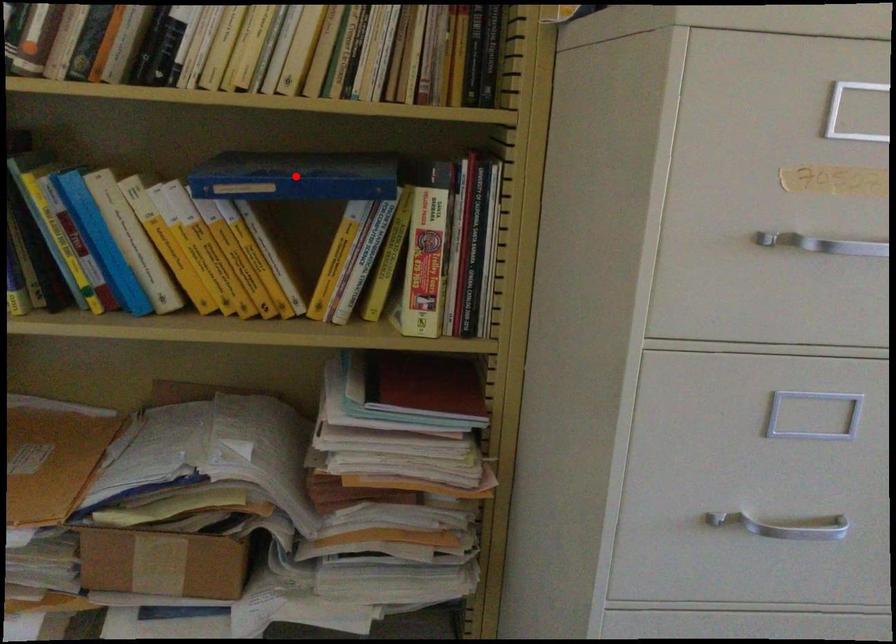
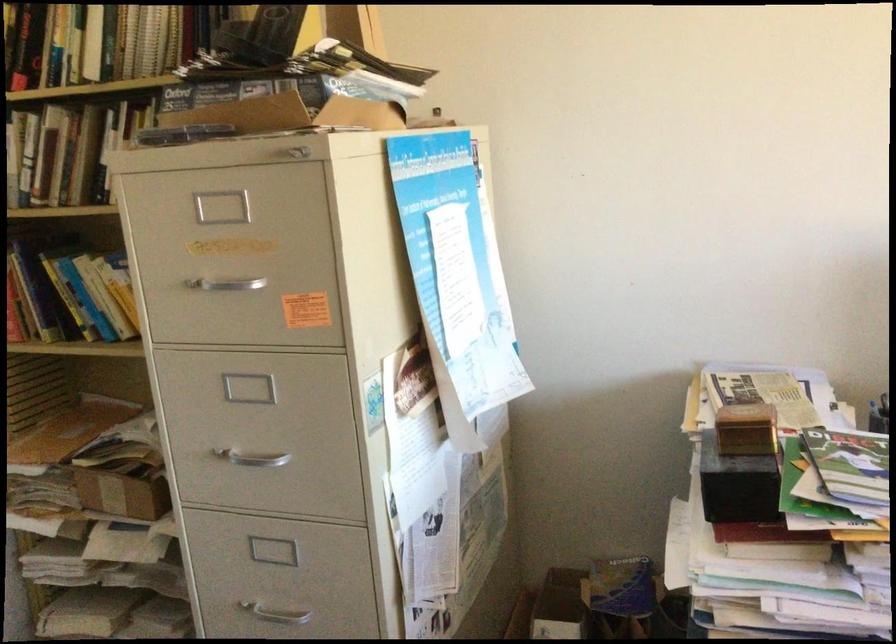
Question: I am providing you with two images of the same scene from different viewpoints. A red point is marked on the first image. Is the red point's position out of view in image 2?

Choices:
 (A) Yes
 (B) No

Answer: (A)